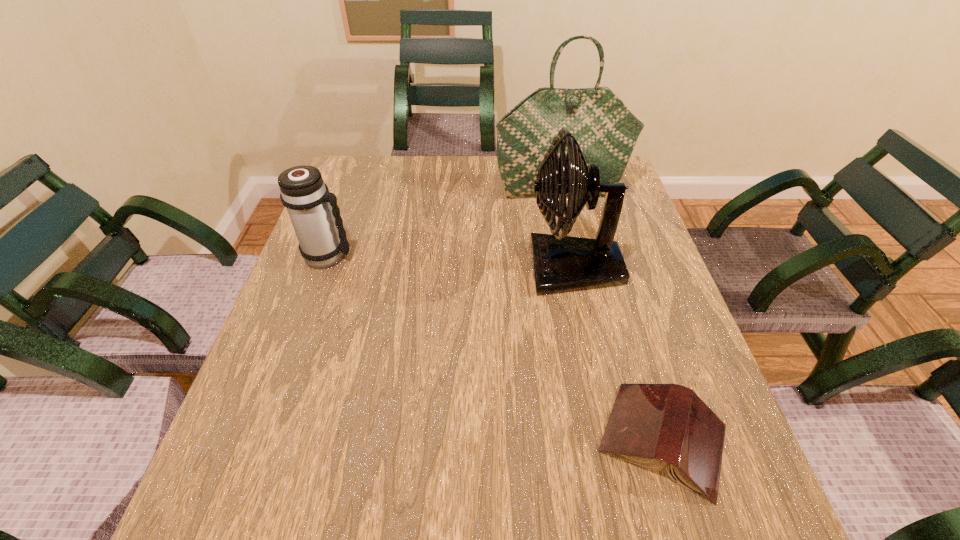
The height and width of the screenshot is (540, 960). I want to click on tote bag, so click(x=606, y=130).

The height and width of the screenshot is (540, 960). I want to click on the tallest object, so click(x=606, y=130).

The image size is (960, 540). What are the coordinates of `the second tallest object` in the screenshot? It's located at (561, 263).

The width and height of the screenshot is (960, 540). Find the location of `the second shortest object`. the second shortest object is located at coordinates (322, 239).

This screenshot has height=540, width=960. In order to click on the leftmost object in this screenshot , I will do `click(322, 239)`.

Where is `the shortest object`? This screenshot has width=960, height=540. the shortest object is located at coordinates (651, 425).

Find the location of a particular element. book is located at coordinates (651, 425).

Find the location of a particular element. This screenshot has height=540, width=960. blank space located on the front of the tote bag is located at coordinates (566, 216).

Image resolution: width=960 pixels, height=540 pixels. In order to click on vacant space located 0.140m in front of the fan to blow air in this screenshot , I will do `click(468, 268)`.

Identify the location of vacant space located 0.200m in front of the fan to blow air. (444, 268).